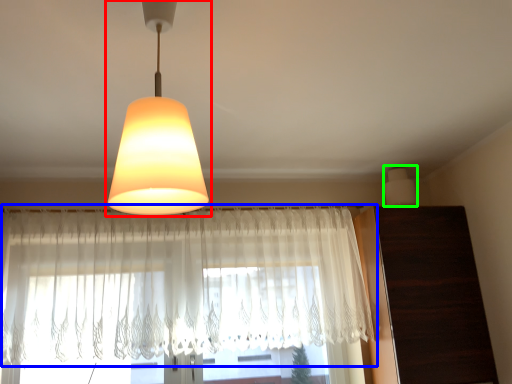
Question: Which object is positioned farthest from lamp (highlighted by a red box)? Select from curtain (highlighted by a blue box) and lamp (highlighted by a green box).

Choices:
 (A) curtain
 (B) lamp

Answer: (B)